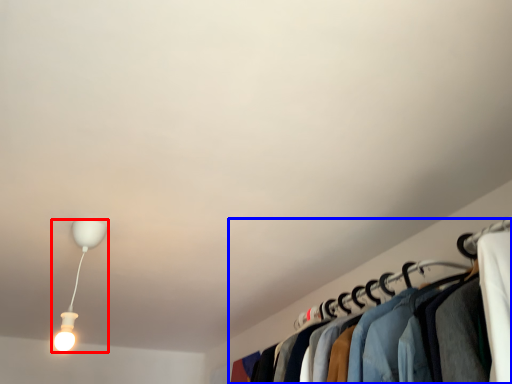
Question: Which point is closer to the camera, lamp (highlighted by a red box) or closet (highlighted by a blue box)?

Choices:
 (A) lamp
 (B) closet

Answer: (B)